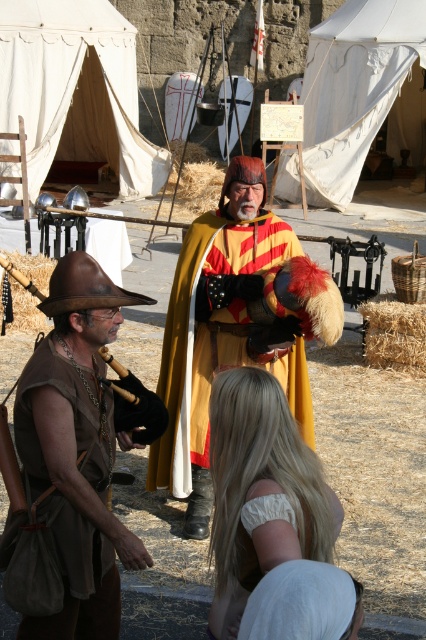
Is point (158, 148) in front of point (26, 296)?

That is False.

Where is `white canvas tent at upper left`? This screenshot has height=640, width=426. white canvas tent at upper left is located at coordinates (75, 90).

Is point (6, 35) closer to viewer compared to point (16, 308)?

No, (6, 35) is behind (16, 308).

In order to click on white canvas tent at upper left in this screenshot , I will do `click(75, 90)`.

Based on the photo, can you confirm if light brown straw bale at lower right is thinner than brown leather cowboy hat at lower left?

No, light brown straw bale at lower right is not thinner than brown leather cowboy hat at lower left.

Looking at this image, who is shorter, light brown straw bale at lower right or brown leather cowboy hat at lower left?

brown leather cowboy hat at lower left

Who is more distant from viewer, (363, 323) or (74, 253)?

The point (363, 323) is behind.

Locate an element on the screen. Image resolution: width=426 pixels, height=640 pixels. light brown straw bale at lower right is located at coordinates (394, 333).

Can you confirm if white canvas tent at upper left is positioned above gold/yellow velvet cape at center?

Yes.

Does point (106, 0) lie behind point (178, 259)?

Yes, it is behind point (178, 259).

The image size is (426, 640). Identify the location of white canvas tent at upper left. (75, 90).